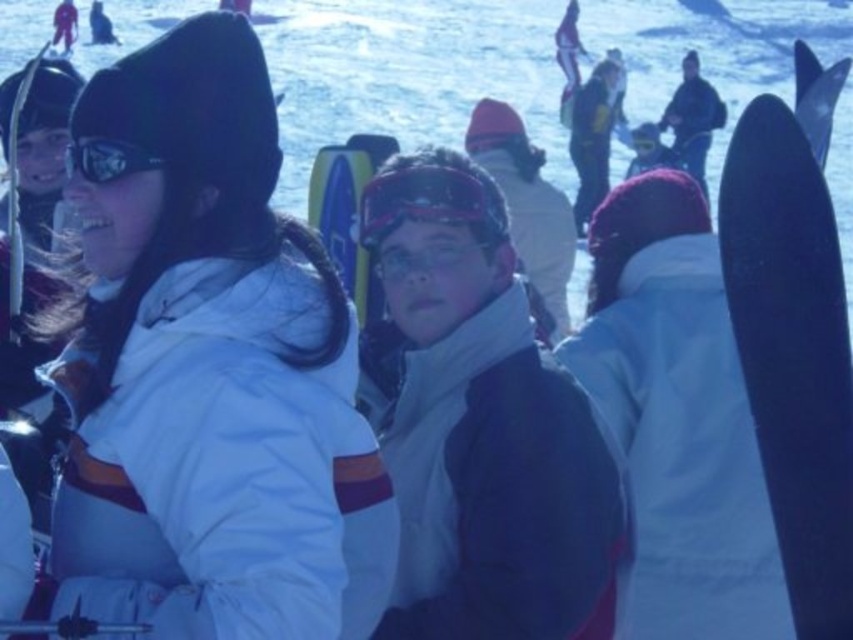
You are a photographer trying to capture a clear photo of the matte blue jacket at center and the matte black goggles at upper left. Since you want both objects to appear equally prominent in the photo, which object should you zoom in on more?

The matte blue jacket at center is larger than the matte black goggles at upper left, so you should zoom in more on the matte black goggles at upper left to make them appear the same size in the photo.

You are a photographer taking a picture of the scene. You notice two points in the image labeled as point 1 at coordinates point (428, 323) and point 2 at coordinates point (144, 168). If you want to focus on the closer point to the camera, which point should you choose?

Point 2 at coordinates point (144, 168) is closer to the camera than point 1 at coordinates point (428, 323), so you should choose point 2.

Looking at this image, you are planning to take a photo of the matte blue jacket at center and the matte black goggles at upper left. Since you want both items to appear clearly in the frame, which one should you focus on first to ensure proper focus?

You should focus on the matte blue jacket at center first because it is taller than the matte black goggles at upper left, making it a larger subject to capture clearly.